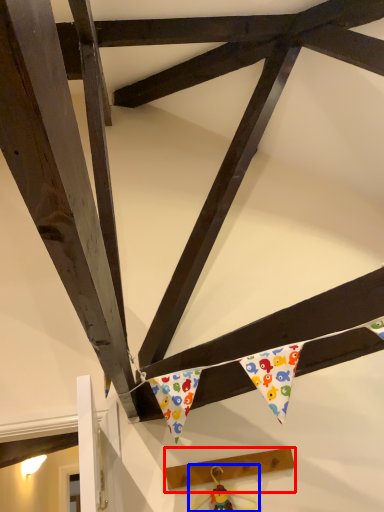
Question: Which point is closer to the camera, plank (highlighted by a red box) or toy (highlighted by a blue box)?

Choices:
 (A) plank
 (B) toy

Answer: (B)